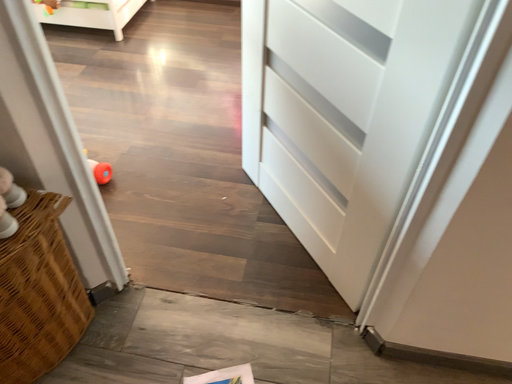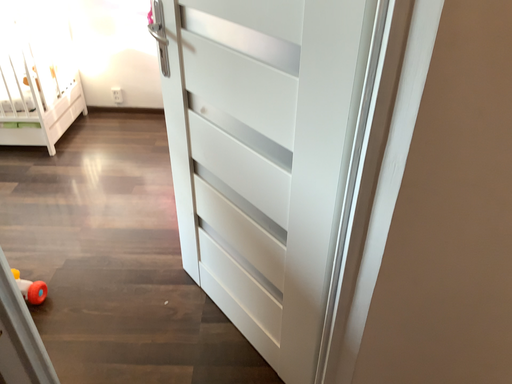
Question: How did the camera likely rotate when shooting the video?

Choices:
 (A) rotated downward
 (B) rotated upward

Answer: (B)